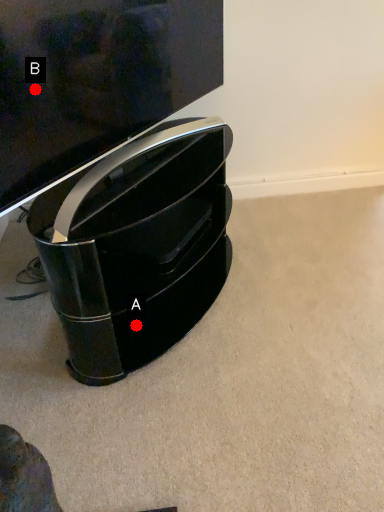
Question: Two points are circled on the image, labeled by A and B beside each circle. Which of the following is the closest to the observer?

Choices:
 (A) A is closer
 (B) B is closer

Answer: (B)